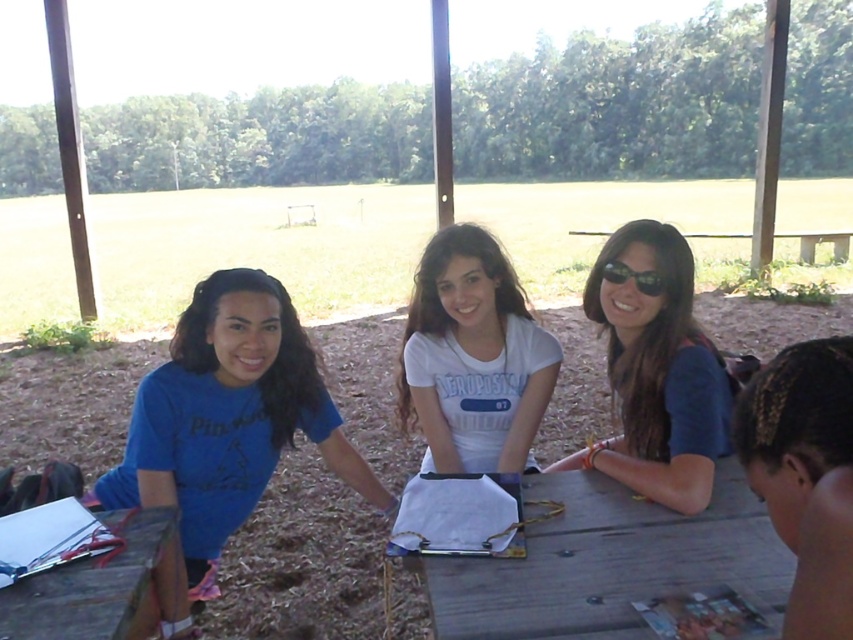
Is wooden picnic table at lower left below black plastic sunglasses at upper center?

Correct, wooden picnic table at lower left is located below black plastic sunglasses at upper center.

Between point (10, 602) and point (621, 282), which one is positioned in front?

Point (10, 602) is more forward.

Locate an element on the screen. wooden picnic table at lower left is located at coordinates (88, 588).

In order to click on dark brown hair at lower right in this screenshot , I will do `click(804, 468)`.

Who is more distant from viewer, [804,436] or [647,292]?

Point [647,292]

Identify the location of dark brown hair at lower right. (804, 468).

Can you confirm if wooden table at center is positioned to the left of black plastic sunglasses at upper center?

Yes, wooden table at center is to the left of black plastic sunglasses at upper center.

Which is below, wooden table at center or black plastic sunglasses at upper center?

wooden table at center is below.

Locate an element on the screen. The width and height of the screenshot is (853, 640). wooden table at center is located at coordinates (608, 563).